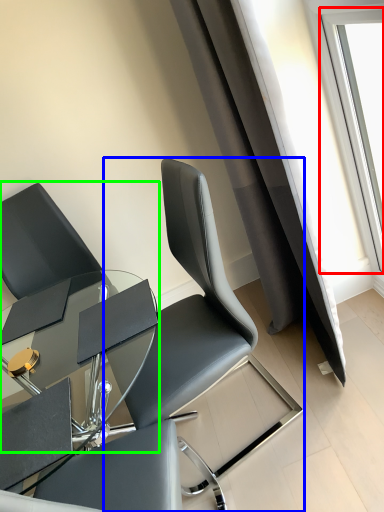
Question: Which object is the closest to the window (highlighted by a red box)? Choose among these: chair (highlighted by a blue box) or chair (highlighted by a green box).

Choices:
 (A) chair
 (B) chair

Answer: (A)